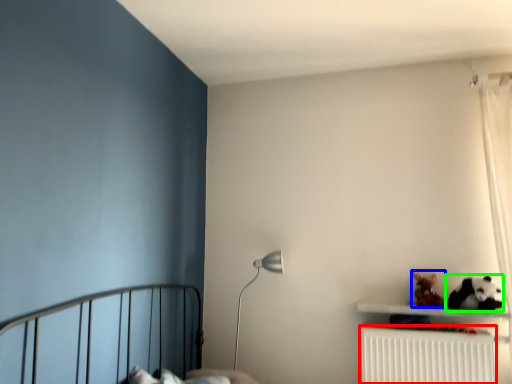
Question: Based on their relative distances, which object is nearer to radiator (highlighted by a red box)? Choose from toy (highlighted by a blue box) and animal (highlighted by a green box).

Choices:
 (A) toy
 (B) animal

Answer: (A)